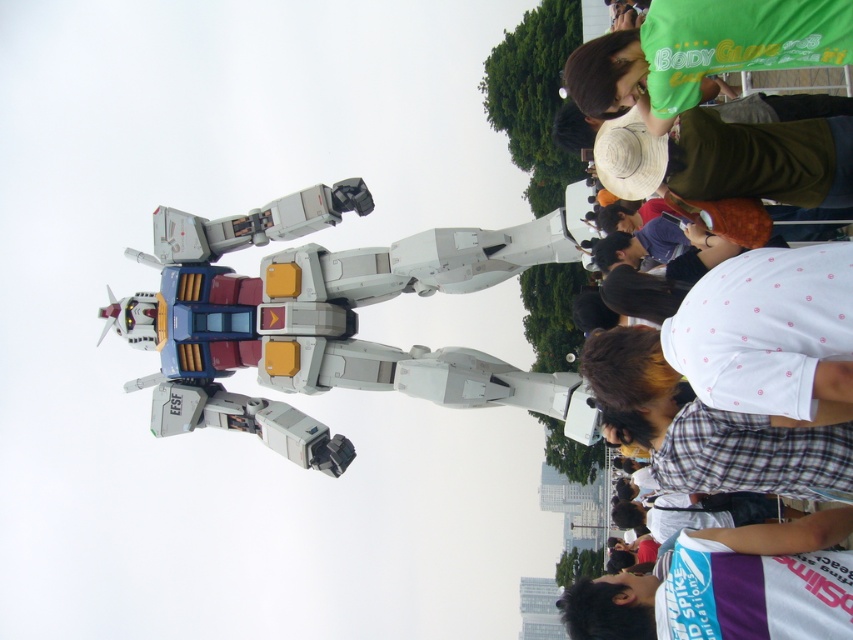
Image resolution: width=853 pixels, height=640 pixels. I want to click on white dotted shirt at upper right, so click(x=738, y=339).

Who is shorter, green fabric shirt at upper right or white fabric at lower right?

white fabric at lower right

Can you confirm if green fabric shirt at upper right is positioned to the right of white fabric at lower right?

In fact, green fabric shirt at upper right is to the left of white fabric at lower right.

You are a GUI agent. You are given a task and a screenshot of the screen. Output one action in this format:
    pyautogui.click(x=<x>, y=<y>)
    Task: Click on the green fabric shirt at upper right
    Image resolution: width=853 pixels, height=640 pixels.
    Given the screenshot: What is the action you would take?
    pyautogui.click(x=701, y=51)

Who is higher up, white dotted shirt at upper right or green fabric shirt at upper right?

green fabric shirt at upper right is higher up.

Measure the distance between point (x=798, y=330) and camera.

Point (x=798, y=330) and camera are 295.50 feet apart from each other.

Locate an element on the screen. This screenshot has height=640, width=853. white dotted shirt at upper right is located at coordinates (738, 339).